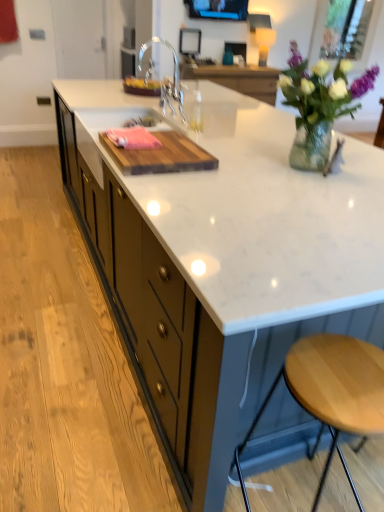
In order to click on vacant space situated on the left part of chrome metallic faucet at center in this screenshot , I will do `click(102, 115)`.